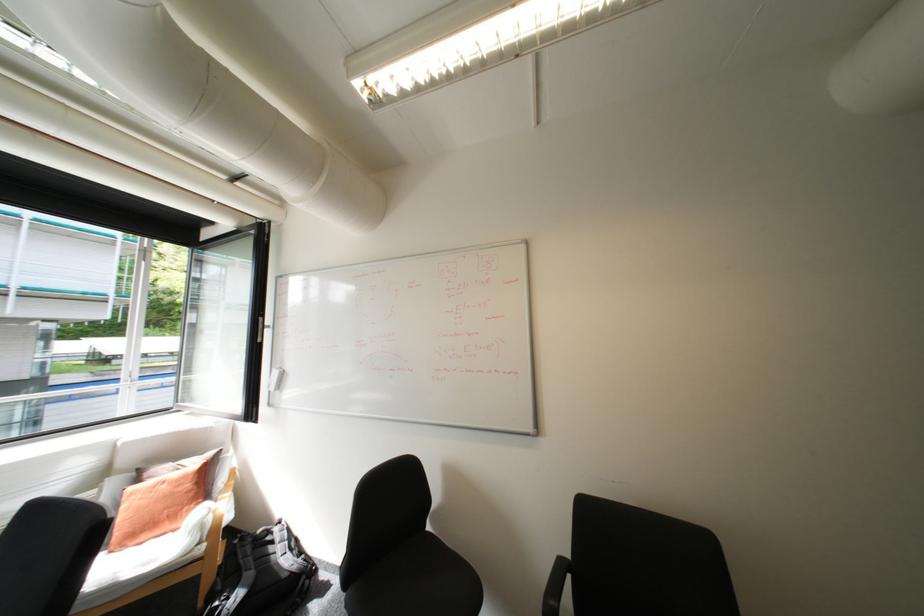
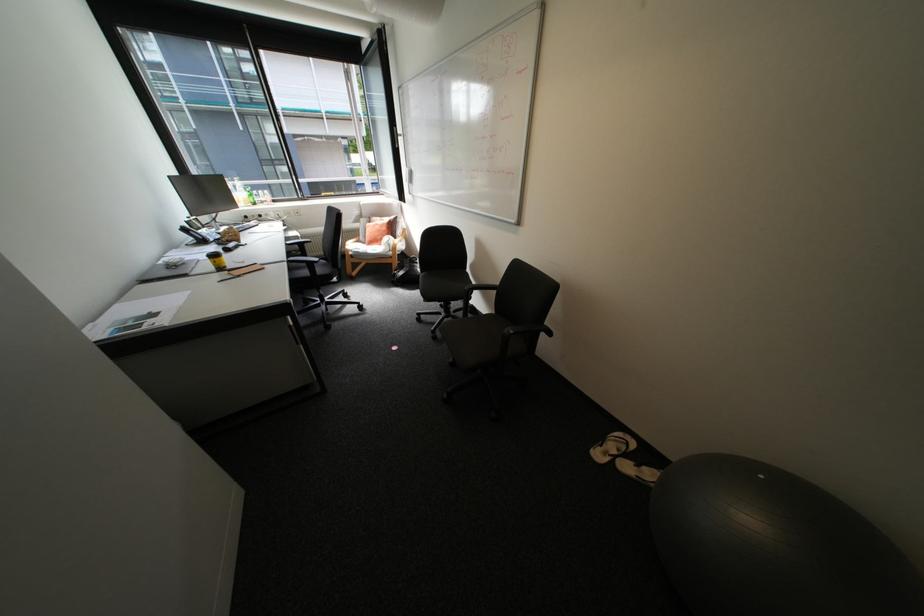
The point at (215, 513) is marked in the first image. Where is the corresponding point in the second image?

(397, 238)